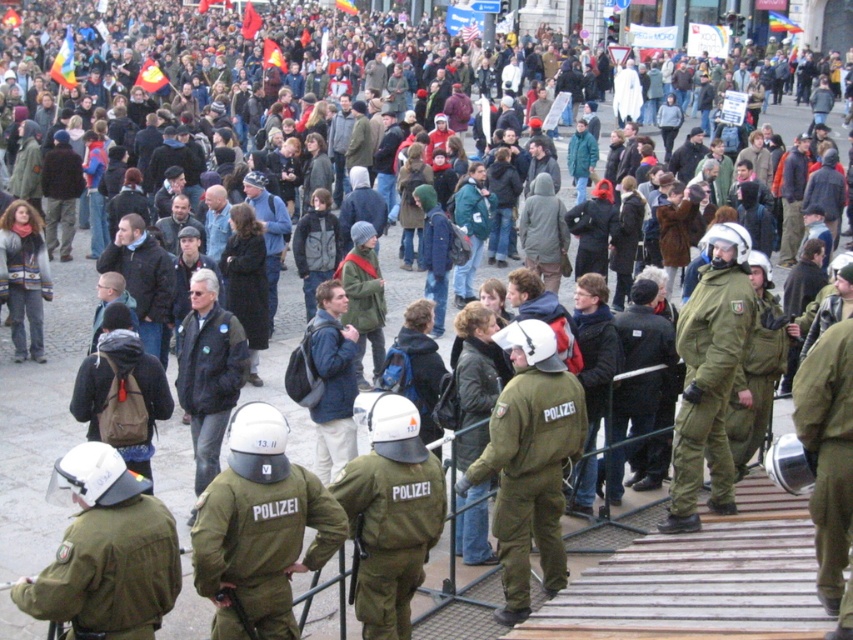
You are a photographer trying to capture a clear shot of both the green uniformed officer at center and the dark blue leather jacket at center. Since you want to ensure both are fully visible in your photo, which object should you focus on first to avoid missing any details?

You should focus on the dark blue leather jacket at center first because it is wider than the green uniformed officer at center, so capturing its full width will ensure there is enough space for the narrower officer in the frame.

From the picture: You are a participant in the protest and want to approach the barricade. The officer at point (x=709, y=376) is blocking your path. Can you go around them to reach the barricade?

The point (x=709, y=376) is on the green uniformed officer at center, so you can go around them to reach the barricade as long as there is space on either side of the officer.

You are a photographer trying to capture a clear shot of the green uniformed officer at center and the blue fabric backpack at center. Which object is wider?

The blue fabric backpack at center is wider than the green uniformed officer at center.